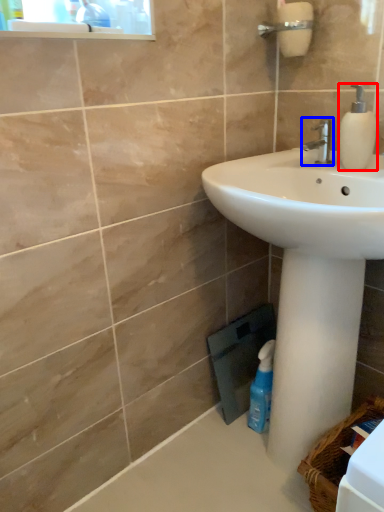
Question: Which object appears farthest to the camera in this image, soap dispenser (highlighted by a red box) or tap (highlighted by a blue box)?

Choices:
 (A) soap dispenser
 (B) tap

Answer: (B)